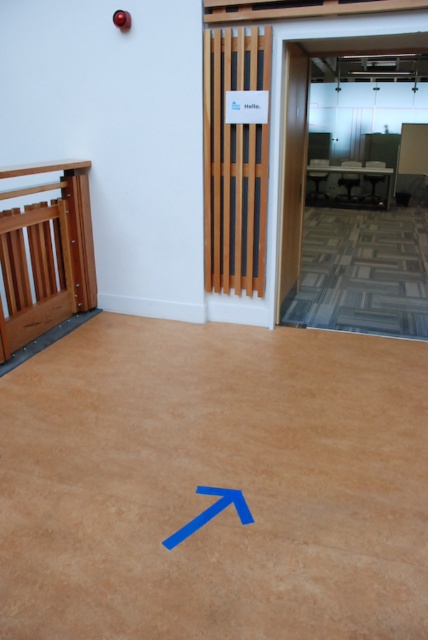
You are a delivery person trying to locate the entrance to the conference room. You see the wooden gate at left and the blue matte arrow at upper center. Which object should you pay attention to for guidance?

The blue matte arrow at upper center points towards the center left area, so you should follow the direction it indicates to locate the entrance to the conference room.

You are standing in an office space and see the wooden gate at left and the blue matte arrow at upper center. According to the arrow, which direction should you move towards to reach the area the arrow is pointing at?

The wooden gate at left is located above the blue matte arrow at upper center. Since the arrow points towards the center left, you should move downward from the wooden gate at left towards the direction indicated by the blue matte arrow at upper center.

You are standing in the office space and need to choose between two elevators to reach the 10th floor quickly. The transparent glass elevator at upper center and the wooden elevator at center are both available. Which one should you choose based on their size?

The transparent glass elevator at upper center might be wider than wooden elevator at center, so it could accommodate more people or items, making it a better choice for reaching the 10th floor quickly if space is a priority.